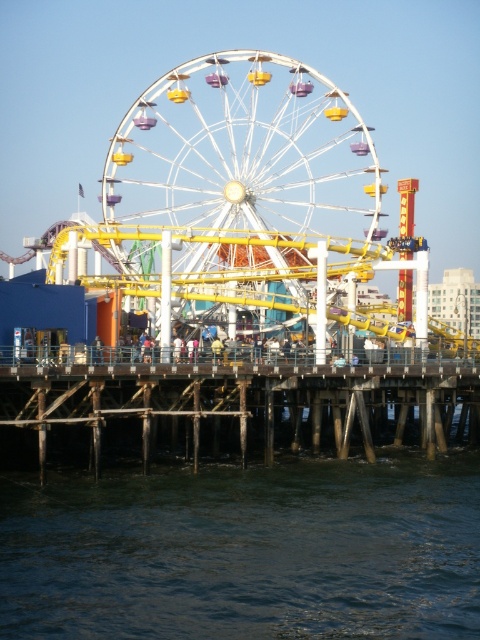
Question: Which of the following is the closest to the observer?

Choices:
 (A) (408, 534)
 (B) (372, 216)

Answer: (A)

Question: Does dark blue water at lower center appear on the right side of wooden at center?

Choices:
 (A) no
 (B) yes

Answer: (A)

Question: Which of the following is the farthest from the observer?

Choices:
 (A) wooden at center
 (B) white metallic ferris wheel at center
 (C) dark blue water at lower center

Answer: (B)

Question: Considering the real-world distances, which object is farthest from the white metallic ferris wheel at center?

Choices:
 (A) dark blue water at lower center
 (B) wooden at center

Answer: (A)

Question: Can you confirm if white metallic ferris wheel at center is smaller than wooden at center?

Choices:
 (A) yes
 (B) no

Answer: (B)

Question: Does white metallic ferris wheel at center lie behind wooden at center?

Choices:
 (A) no
 (B) yes

Answer: (B)